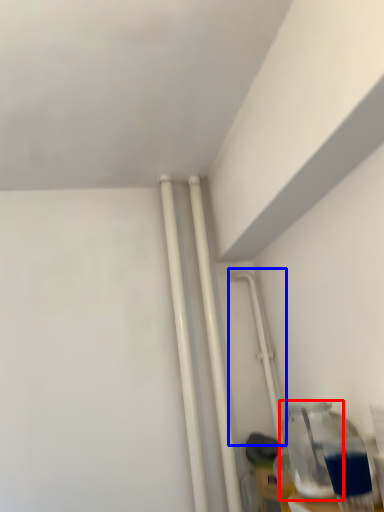
Question: Which of the following is the farthest to the observer, bottle (highlighted by a red box) or water pipe (highlighted by a blue box)?

Choices:
 (A) bottle
 (B) water pipe

Answer: (B)